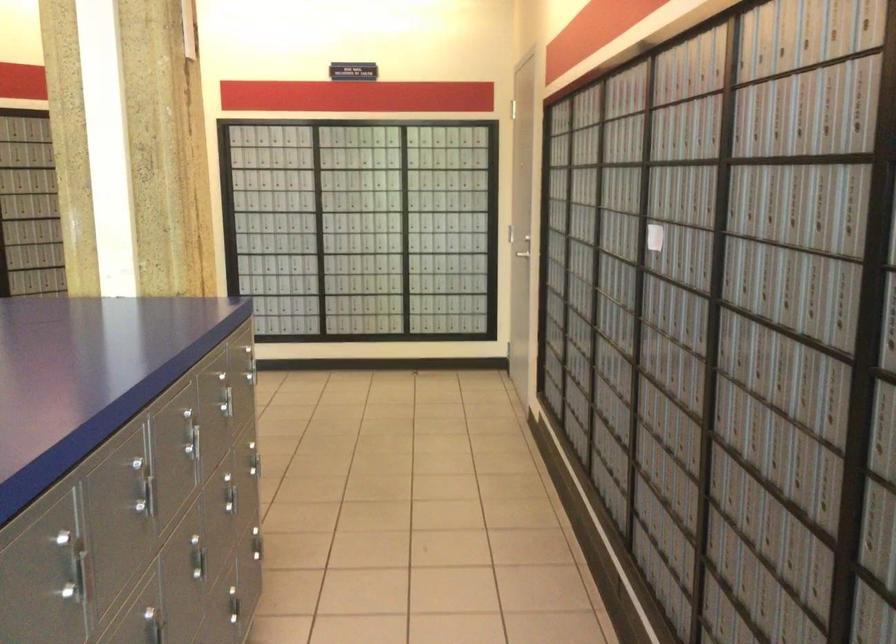
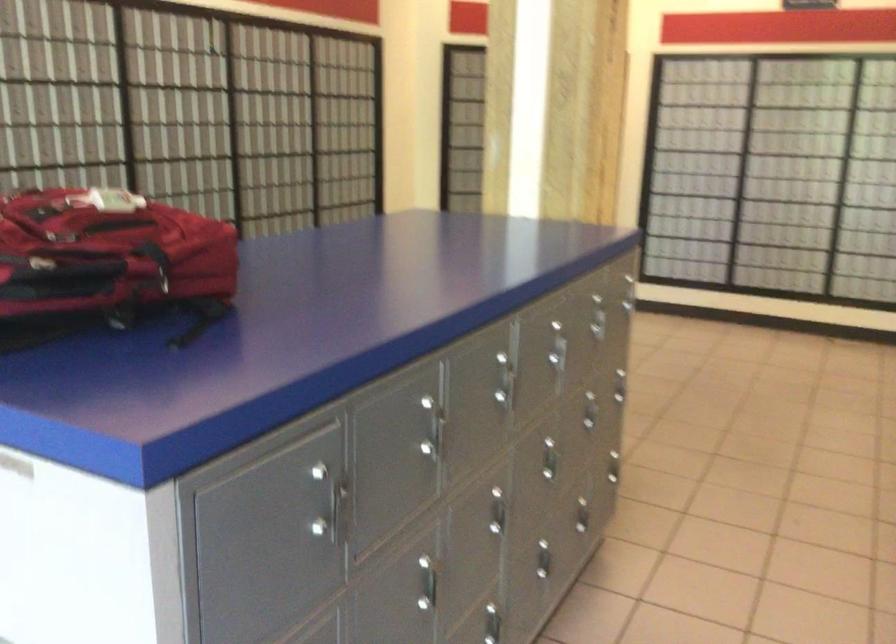
Where in the second image is the point corresponding to the point at 225,395 from the first image?

(601, 317)